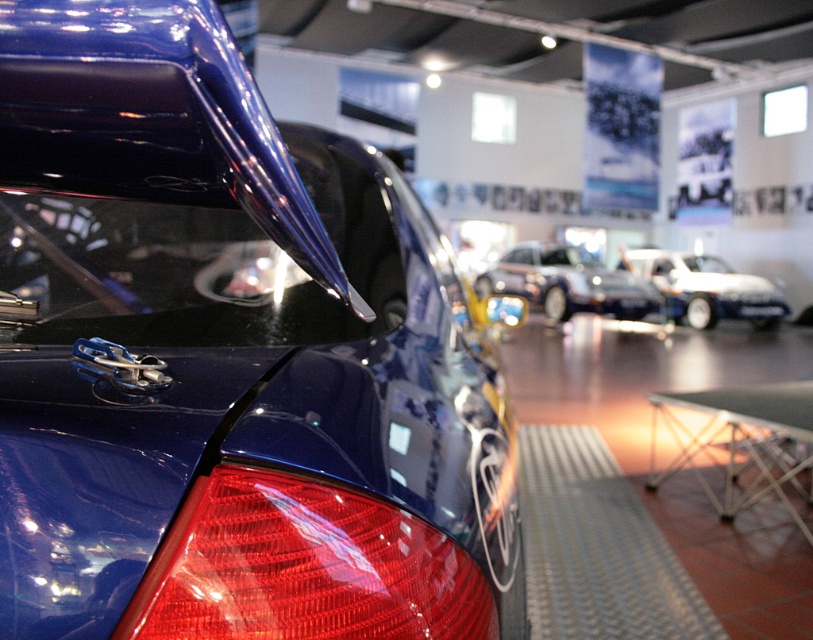
You are a photographer standing in front of the shiny metallic car at center and the glossy blue spoiler at upper left. You want to capture a photo that includes both objects in the frame. Considering their heights, which object should you position closer to the camera to ensure both are fully visible?

The glossy blue spoiler at upper left is not as tall as the shiny metallic car at center, so you should position the glossy blue spoiler at upper left closer to the camera to ensure both are fully visible in the photo.

You are standing in a car showroom and want to locate the glossy blue spoiler at upper left on the rear section of a blue car. Based on its coordinates, where exactly should you look on the car?

The glossy blue spoiler at upper left is located at coordinates point [151,118] on the car.

You are a photographer trying to capture the white glossy car at center without the black plastic license plate at center appearing in the shot. Is this possible given their positions?

The white glossy car at center is in front of the black plastic license plate at center, so it would block the license plate from view. Therefore, you can capture the white glossy car at center without the black plastic license plate at center appearing in the shot.